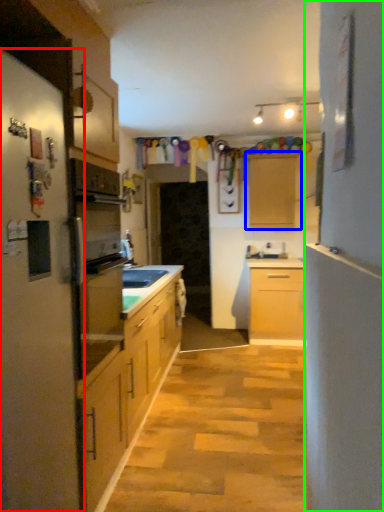
Question: Which object is the closest to the fridge (highlighted by a red box)? Choose among these: cabinetry (highlighted by a blue box) or side (highlighted by a green box).

Choices:
 (A) cabinetry
 (B) side

Answer: (B)